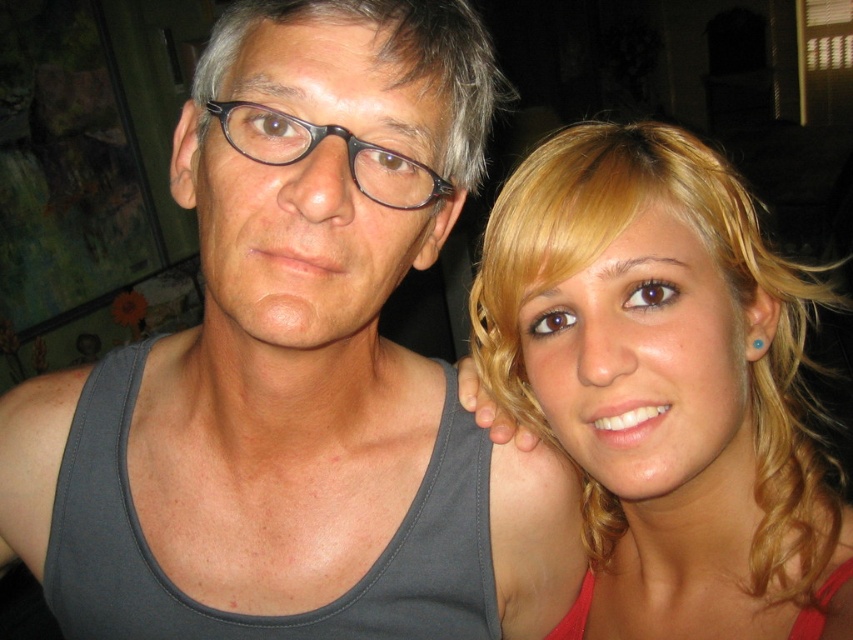
Who is lower down, blonde hair at right or matte black glasses at center?

blonde hair at right is lower down.

Who is positioned more to the right, blonde hair at right or matte black glasses at center?

blonde hair at right is more to the right.

Is point (592, 131) positioned in front of point (218, 104)?

No, (592, 131) is behind (218, 104).

In order to click on blonde hair at right in this screenshot , I will do `click(665, 385)`.

Between gray matte tank top at left and matte black glasses at center, which one has more height?

gray matte tank top at left

Who is more distant from viewer, (378, 474) or (389, 193)?

The point (378, 474) is more distant.

Locate an element on the screen. gray matte tank top at left is located at coordinates (299, 371).

How much distance is there between gray matte tank top at left and blonde hair at right?

A distance of 5.47 inches exists between gray matte tank top at left and blonde hair at right.

Is point (274, 515) behind point (706, 243)?

That is True.

The width and height of the screenshot is (853, 640). Find the location of `gray matte tank top at left`. gray matte tank top at left is located at coordinates (299, 371).